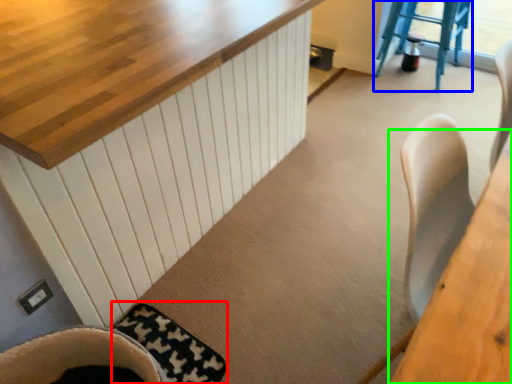
Question: Which is nearer to the mat (highlighted by a red box)? step stool (highlighted by a blue box) or table (highlighted by a green box).

Choices:
 (A) step stool
 (B) table

Answer: (B)